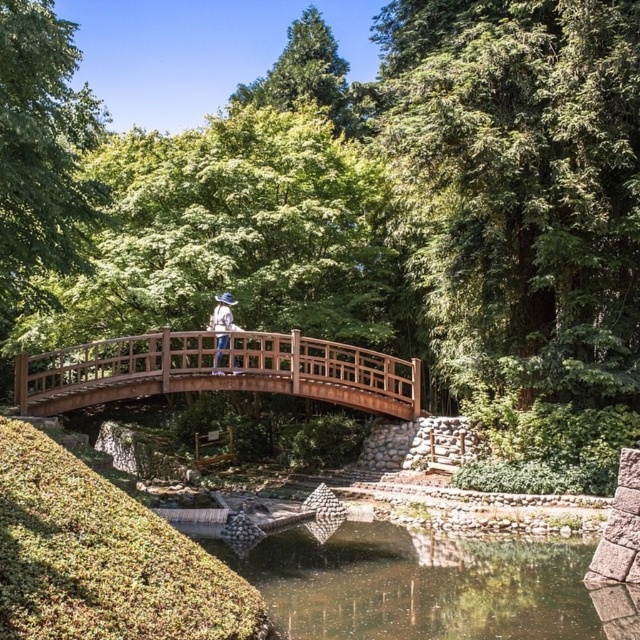
You are a hiker who wants to cross the wooden bridge at center while wearing the white fabric hat at center. Will your hat stay visible above the bridge railing when you walk across?

The wooden bridge at center is taller than the white fabric hat at center, so the hat will not go above the bridge railing and will remain visible.

You are a hiker standing on the wooden bridge in the forest scene. You notice the clear water at center and the white fabric hat at center. Which object is closer to you as you look straight ahead?

The clear water at center is closer to you because it is in front of the white fabric hat at center.

You are standing on the wooden bridge at the center of the forest scene. Looking down, you notice the clear water at center. Where exactly is the clear water located in terms of coordinates?

The clear water at center is located at coordinates point (422, 582).